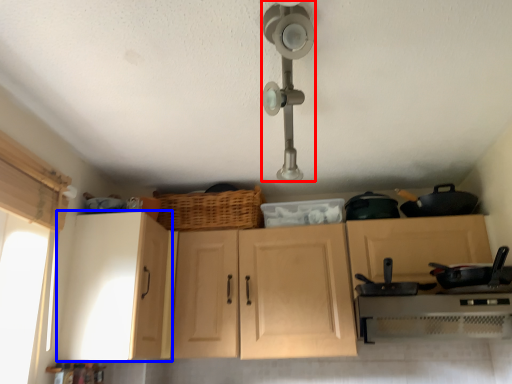
Question: Which of the following is the farthest to the observer, light fixture (highlighted by a red box) or cabinetry (highlighted by a blue box)?

Choices:
 (A) light fixture
 (B) cabinetry

Answer: (B)